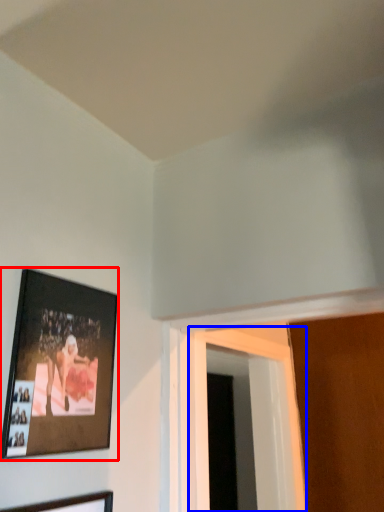
Question: Which object appears farthest to the camera in this image, picture frame (highlighted by a red box) or window (highlighted by a blue box)?

Choices:
 (A) picture frame
 (B) window

Answer: (B)